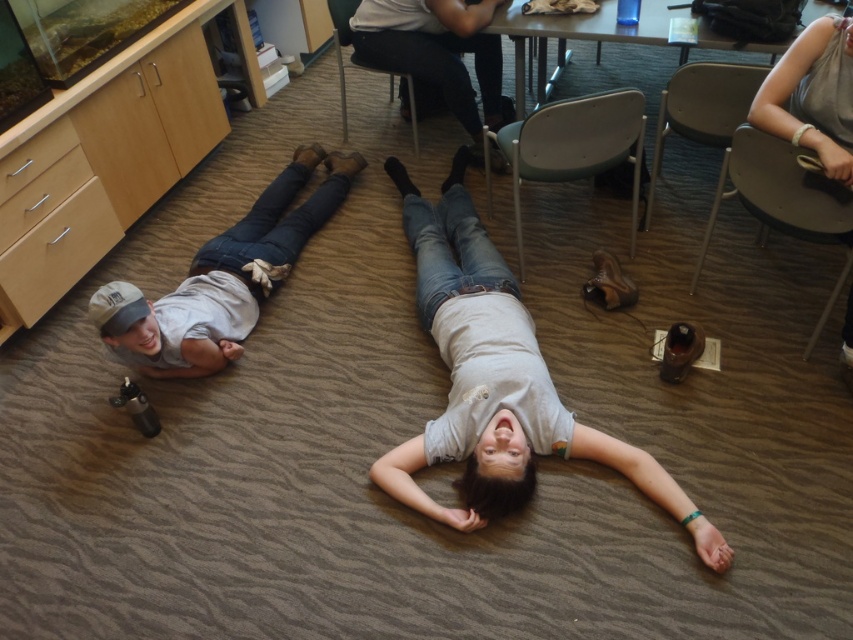
You are standing at the point labeled as point (801, 108) and want to move to the point labeled as point (223, 339). According to the image, which direction should you face to walk towards your destination?

You should face downward because point (223, 339) is behind point (801, 108), meaning it is located in the lower direction from your current position.

You are a guest in this room and want to place your gray fabric purse at upper right on the metallic gray chair at upper right. Can you put it directly on the chair without moving anything else?

The gray fabric purse at upper right is already to the right of the metallic gray chair at upper right, so you can place it directly on the chair without moving anything else.

You are standing in the room and want to move from the point at coordinates [189,376] to the point at coordinates [343,129]. Based on the spatial relationship between these two points, which direction should you move to get closer to your destination?

You should move backward because point [189,376] is in front of point [343,129], meaning the destination is behind the starting point.